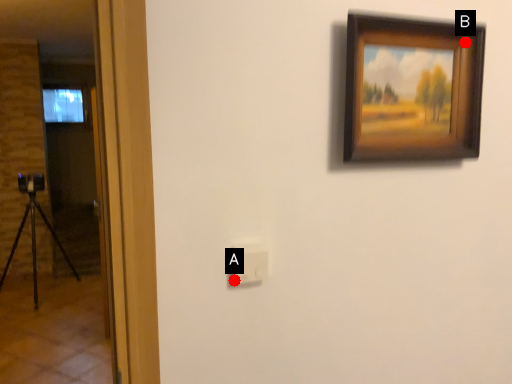
Question: Two points are circled on the image, labeled by A and B beside each circle. Among these points, which one is farthest from the camera?

Choices:
 (A) A is further
 (B) B is further

Answer: (B)